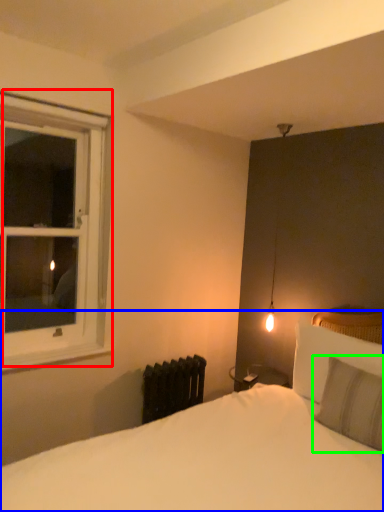
Question: Considering the real-world distances, which object is farthest from window (highlighted by a red box)? bed (highlighted by a blue box) or pillow (highlighted by a green box)?

Choices:
 (A) bed
 (B) pillow

Answer: (B)